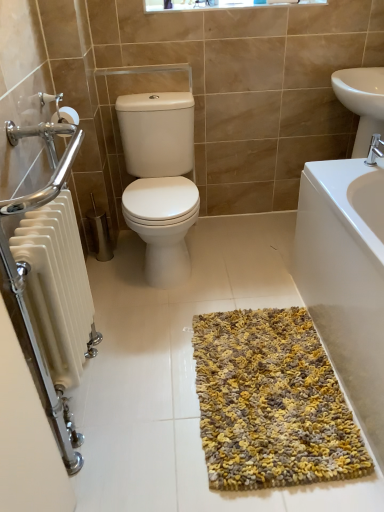
This screenshot has height=512, width=384. I want to click on yellow-grey shaggy rug at center, so click(x=271, y=403).

Find the location of a particular element. white glossy toilet at center is located at coordinates (160, 179).

At what (x,y) coordinates should I click in order to perform the action: click on white glossy sink at upper right. Please return your answer as a coordinate pair (x, y). The height and width of the screenshot is (512, 384). Looking at the image, I should click on click(362, 102).

Which object is closer to the camera, yellow-grey shaggy rug at center or white glossy toilet at center?

yellow-grey shaggy rug at center is more forward.

From a real-world perspective, is yellow-grey shaggy rug at center on top of white glossy toilet at center?

Incorrect, from a real-world perspective, yellow-grey shaggy rug at center is lower than white glossy toilet at center.

Can you confirm if yellow-grey shaggy rug at center is bigger than white glossy toilet at center?

Actually, yellow-grey shaggy rug at center might be smaller than white glossy toilet at center.

Is silver metallic faucet at upper right far from yellow-grey shaggy rug at center?

Actually, silver metallic faucet at upper right and yellow-grey shaggy rug at center are a little close together.

From a real-world perspective, relative to yellow-grey shaggy rug at center, is silver metallic faucet at upper right vertically above or below?

In terms of real-world spatial position, silver metallic faucet at upper right is above yellow-grey shaggy rug at center.

Considering the sizes of objects silver metallic faucet at upper right and yellow-grey shaggy rug at center in the image provided, who is bigger, silver metallic faucet at upper right or yellow-grey shaggy rug at center?

Bigger between the two is yellow-grey shaggy rug at center.

Is white glossy toilet at center inside or outside of white plastic window frame at upper center?

The correct answer is: outside.

In the scene shown: Is white glossy toilet at center in front of white plastic window frame at upper center?

Yes, white glossy toilet at center is in front of white plastic window frame at upper center.

Identify the location of window frame behind the white glossy toilet at center. (219, 4).

Considering the sizes of objects white glossy toilet at center and white plastic window frame at upper center in the image provided, who is taller, white glossy toilet at center or white plastic window frame at upper center?

white glossy toilet at center.

Between silver metallic faucet at upper right and white glossy sink at upper right, which one has smaller size?

Smaller between the two is silver metallic faucet at upper right.

Is silver metallic faucet at upper right not near white glossy sink at upper right?

No.

From the picture: Is white glossy sink at upper right inside silver metallic faucet at upper right?

No, silver metallic faucet at upper right does not contain white glossy sink at upper right.

In order to click on tap that appears in front of the white glossy sink at upper right in this screenshot , I will do `click(374, 150)`.

Which of these two, yellow-grey shaggy rug at center or white plastic window frame at upper center, is wider?

Wider between the two is yellow-grey shaggy rug at center.

Between yellow-grey shaggy rug at center and white plastic window frame at upper center, which one has more height?

yellow-grey shaggy rug at center is taller.

Consider the image. Is yellow-grey shaggy rug at center not close to white plastic window frame at upper center?

yellow-grey shaggy rug at center is positioned a significant distance from white plastic window frame at upper center.

Is point (320, 426) positioned after point (204, 8)?

No, (320, 426) is closer to viewer.

Is yellow textured bath mat at lower right in front of or behind white plastic window frame at upper center in the image?

yellow textured bath mat at lower right is positioned closer to the viewer than white plastic window frame at upper center.

Are yellow textured bath mat at lower right and white plastic window frame at upper center far apart?

Absolutely, yellow textured bath mat at lower right is distant from white plastic window frame at upper center.

Considering the sizes of objects yellow textured bath mat at lower right and white plastic window frame at upper center in the image provided, who is bigger, yellow textured bath mat at lower right or white plastic window frame at upper center?

With larger size is yellow textured bath mat at lower right.

From a real-world perspective, which object stands above the other?

white plastic window frame at upper center, from a real-world perspective.

Is point (268, 4) farther from viewer compared to point (216, 449)?

That is True.

From the image's perspective, which one is positioned lower, white plastic window frame at upper center or yellow-grey shaggy rug at center?

From the image's view, yellow-grey shaggy rug at center is below.

Locate an element on the screen. This screenshot has width=384, height=512. window frame that is on the left side of yellow-grey shaggy rug at center is located at coordinates (219, 4).

Does white plastic window frame at upper center appear on the left side of yellow-grey shaggy rug at center?

Correct, you'll find white plastic window frame at upper center to the left of yellow-grey shaggy rug at center.

Locate an element on the screen. The width and height of the screenshot is (384, 512). bath mat in front of the white glossy toilet at center is located at coordinates (271, 403).

Image resolution: width=384 pixels, height=512 pixels. What are the coordinates of `tap above the yellow-grey shaggy rug at center (from a real-world perspective)` in the screenshot? It's located at (374, 150).

When comparing their distances from silver metallic faucet at upper right, does yellow-grey shaggy rug at center or yellow textured bath mat at lower right seem further?

Based on the image, yellow-grey shaggy rug at center appears to be further to silver metallic faucet at upper right.

Looking at the image, which one is located closer to yellow textured bath mat at lower right, silver metallic faucet at upper right or white glossy toilet at center?

The object closer to yellow textured bath mat at lower right is silver metallic faucet at upper right.

Based on the photo, estimate the real-world distances between objects in this image. Which object is closer to white glossy sink at upper right, yellow textured bath mat at lower right or white glossy toilet at center?

yellow textured bath mat at lower right.

In the scene shown: Based on their spatial positions, is white glossy toilet at center or white plastic window frame at upper center closer to yellow textured bath mat at lower right?

white glossy toilet at center is closer to yellow textured bath mat at lower right.

Looking at the image, which one is located closer to white glossy toilet at center, white plastic window frame at upper center or silver metallic faucet at upper right?

Based on the image, white plastic window frame at upper center appears to be nearer to white glossy toilet at center.

From the image, which object appears to be nearer to yellow-grey shaggy rug at center, silver metallic faucet at upper right or white glossy sink at upper right?

silver metallic faucet at upper right.

Which object lies nearer to the anchor point white glossy toilet at center, silver metallic faucet at upper right or yellow textured bath mat at lower right?

Among the two, yellow textured bath mat at lower right is located nearer to white glossy toilet at center.

Estimate the real-world distances between objects in this image. Which object is closer to silver metallic faucet at upper right, yellow-grey shaggy rug at center or white plastic window frame at upper center?

white plastic window frame at upper center is closer to silver metallic faucet at upper right.

At what (x,y) coordinates should I click in order to perform the action: click on tap that lies between white glossy sink at upper right and yellow-grey shaggy rug at center from top to bottom. Please return your answer as a coordinate pair (x, y). The image size is (384, 512). Looking at the image, I should click on (374, 150).

Find the location of `tap between white glossy toilet at center and yellow textured bath mat at lower right`. tap between white glossy toilet at center and yellow textured bath mat at lower right is located at coordinates (374, 150).

Identify the location of bath between white plastic window frame at upper center and yellow-grey shaggy rug at center in the vertical direction. The image size is (384, 512). (346, 278).

Image resolution: width=384 pixels, height=512 pixels. I want to click on sink between white plastic window frame at upper center and yellow textured bath mat at lower right in the up-down direction, so click(x=362, y=102).